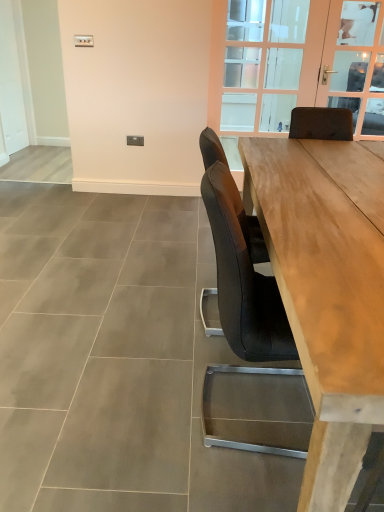
Question: Should I look upward or downward to see clear glass door at upper center?

Choices:
 (A) down
 (B) up

Answer: (B)

Question: Are natural wood table at center and clear glass door at upper center making contact?

Choices:
 (A) yes
 (B) no

Answer: (B)

Question: From the image's perspective, is natural wood table at center located above clear glass door at upper center?

Choices:
 (A) no
 (B) yes

Answer: (A)

Question: Is natural wood table at center facing away from clear glass door at upper center?

Choices:
 (A) yes
 (B) no

Answer: (B)

Question: From a real-world perspective, is natural wood table at center beneath clear glass door at upper center?

Choices:
 (A) no
 (B) yes

Answer: (B)

Question: Does natural wood table at center have a lesser width compared to clear glass door at upper center?

Choices:
 (A) yes
 (B) no

Answer: (B)

Question: Is natural wood table at center positioned before clear glass door at upper center?

Choices:
 (A) yes
 (B) no

Answer: (A)

Question: From the image's perspective, does natural wood table at center appear lower than clear glass door at upper right?

Choices:
 (A) no
 (B) yes

Answer: (B)

Question: From a real-world perspective, is natural wood table at center beneath clear glass door at upper right?

Choices:
 (A) yes
 (B) no

Answer: (A)

Question: From a real-world perspective, is natural wood table at center located higher than clear glass door at upper right?

Choices:
 (A) yes
 (B) no

Answer: (B)

Question: Is natural wood table at center positioned with its back to clear glass door at upper right?

Choices:
 (A) no
 (B) yes

Answer: (A)

Question: Considering the relative sizes of natural wood table at center and clear glass door at upper right in the image provided, is natural wood table at center taller than clear glass door at upper right?

Choices:
 (A) yes
 (B) no

Answer: (B)

Question: Does natural wood table at center appear on the left side of clear glass door at upper right?

Choices:
 (A) yes
 (B) no

Answer: (A)

Question: Does clear glass door at upper center have a greater width compared to clear glass door at upper right?

Choices:
 (A) yes
 (B) no

Answer: (A)